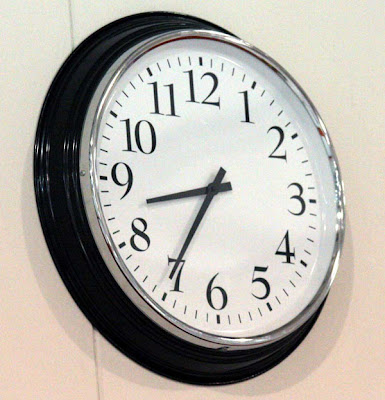
At what (x,y) coordinates should I click in order to perform the action: click on wall. Please return your answer as a coordinate pair (x, y). Looking at the image, I should click on (35, 58).